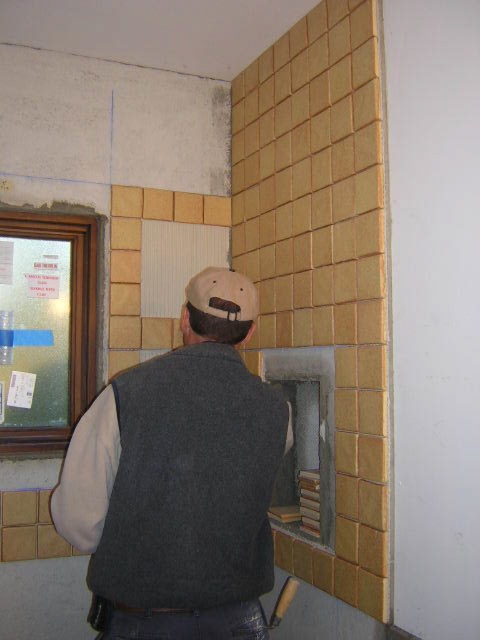
Question: Which point appears farthest from the camera in this image?

Choices:
 (A) (278, 616)
 (B) (144, 572)

Answer: (A)

Question: Is fuzzy beige baseball hat at upper center to the right of wooden handle hammer at lower center from the viewer's perspective?

Choices:
 (A) no
 (B) yes

Answer: (A)

Question: Which object is positioned farthest from the wooden handle hammer at lower center?

Choices:
 (A) yellow tile at center
 (B) dark gray wool vest at center
 (C) fuzzy beige baseball hat at upper center

Answer: (A)

Question: Is dark gray wool vest at center bigger than wooden handle hammer at lower center?

Choices:
 (A) no
 (B) yes

Answer: (B)

Question: Which object is the closest to the fuzzy beige baseball hat at upper center?

Choices:
 (A) yellow tile at center
 (B) dark gray wool vest at center

Answer: (B)

Question: Can you confirm if dark gray wool vest at center is positioned above fuzzy beige baseball hat at upper center?

Choices:
 (A) yes
 (B) no

Answer: (B)